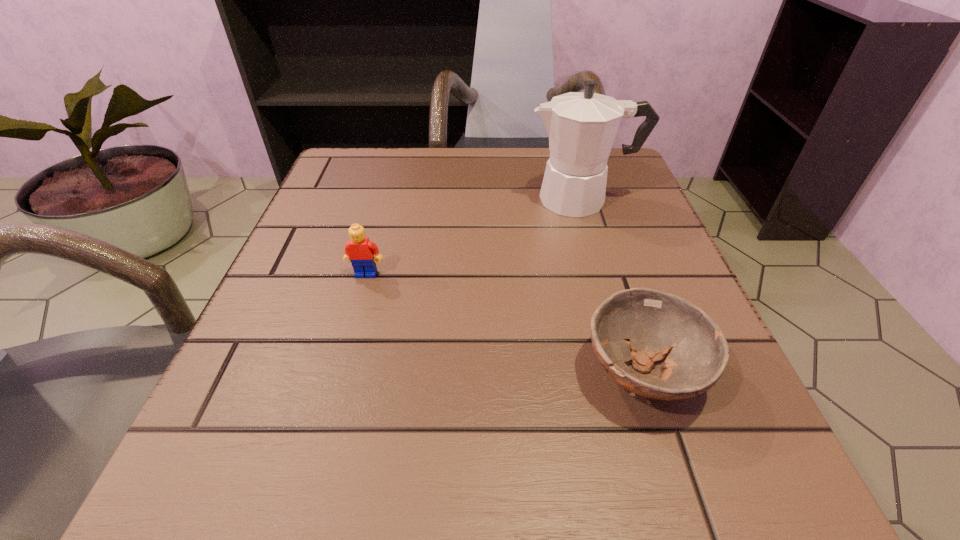
Find the location of a particular element. vacant space located on the back of the shortest object is located at coordinates (606, 255).

Where is `object that is positioned at the far edge`? object that is positioned at the far edge is located at coordinates 581,126.

I want to click on object that is at the left edge, so click(x=360, y=251).

Image resolution: width=960 pixels, height=540 pixels. What are the coordinates of `coffeepot positioned at the right edge` in the screenshot? It's located at (581, 126).

The width and height of the screenshot is (960, 540). Identify the location of bowl that is at the right edge. (655, 323).

I want to click on object that is positioned at the far right corner, so click(x=581, y=126).

Where is `vacant area at the far edge of the desktop`? vacant area at the far edge of the desktop is located at coordinates [x=475, y=166].

In the image, there is a desktop. Identify the location of vacant space at the near edge. The image size is (960, 540). (x=371, y=517).

I want to click on free point at the left edge, so point(330,234).

This screenshot has height=540, width=960. Find the location of `free point at the right edge`. free point at the right edge is located at coordinates (595, 222).